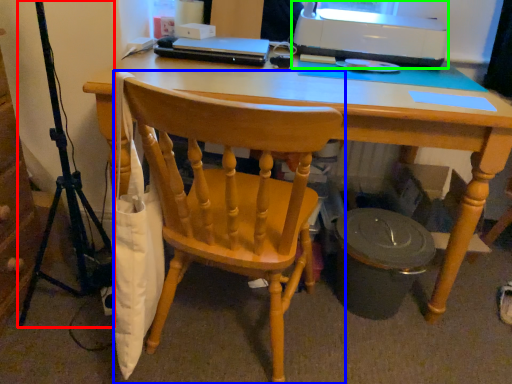
Question: Which is farther away from tripod (highlighted by a red box)? chair (highlighted by a blue box) or printer (highlighted by a green box)?

Choices:
 (A) chair
 (B) printer

Answer: (B)